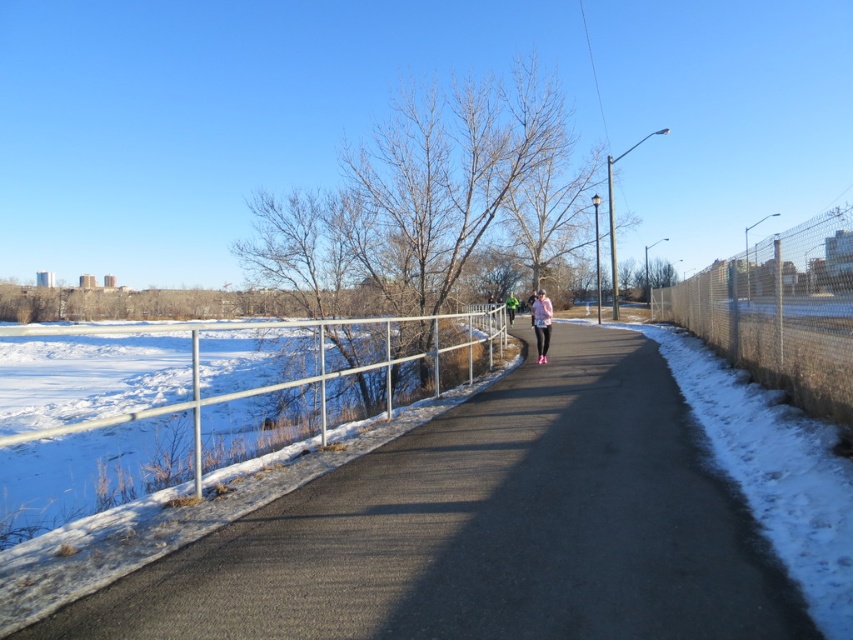
You are a pedestrian standing on the asphalt road at center and want to move to the pink fabric pants at center. Which direction should you go to reach them?

The asphalt road at center is positioned on the left side of pink fabric pants at center, so you should go to the right to reach them.